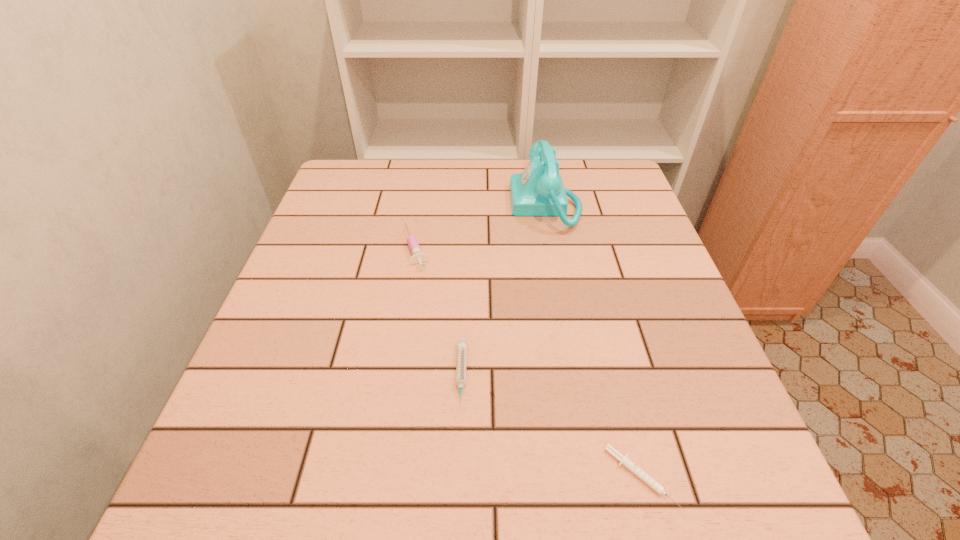
This screenshot has height=540, width=960. Find the location of `vacant space at the near edge`. vacant space at the near edge is located at coordinates (561, 485).

This screenshot has height=540, width=960. In order to click on vacant space at the left edge of the desktop in this screenshot , I will do `click(290, 343)`.

What are the coordinates of `free spot at the right edge of the desktop` in the screenshot? It's located at (651, 252).

Locate an element on the screen. Image resolution: width=960 pixels, height=540 pixels. free space at the far left corner of the desktop is located at coordinates (322, 203).

The width and height of the screenshot is (960, 540). In order to click on vacant space at the far right corner of the desktop in this screenshot , I will do `click(601, 197)`.

The image size is (960, 540). What are the coordinates of `empty location between the second nearest syringe and the third shortest object` in the screenshot? It's located at (439, 312).

The height and width of the screenshot is (540, 960). Identify the location of free area in between the telephone and the second nearest object. (503, 291).

Where is `empty location between the telephone and the leftmost object`? empty location between the telephone and the leftmost object is located at coordinates (481, 226).

The width and height of the screenshot is (960, 540). I want to click on free space between the second syringe from right to left and the tallest object, so click(x=503, y=291).

Identify the location of free space between the farthest syringe and the shortest object. (529, 362).